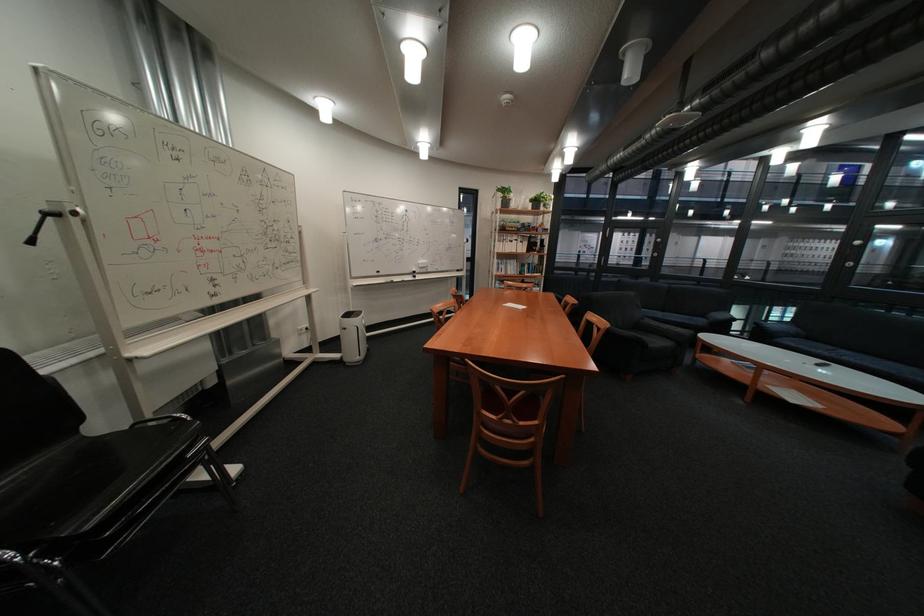
Find where to sit the black chair sitting surface. Please return your answer as a coordinate pair (x, y).

(84, 483)